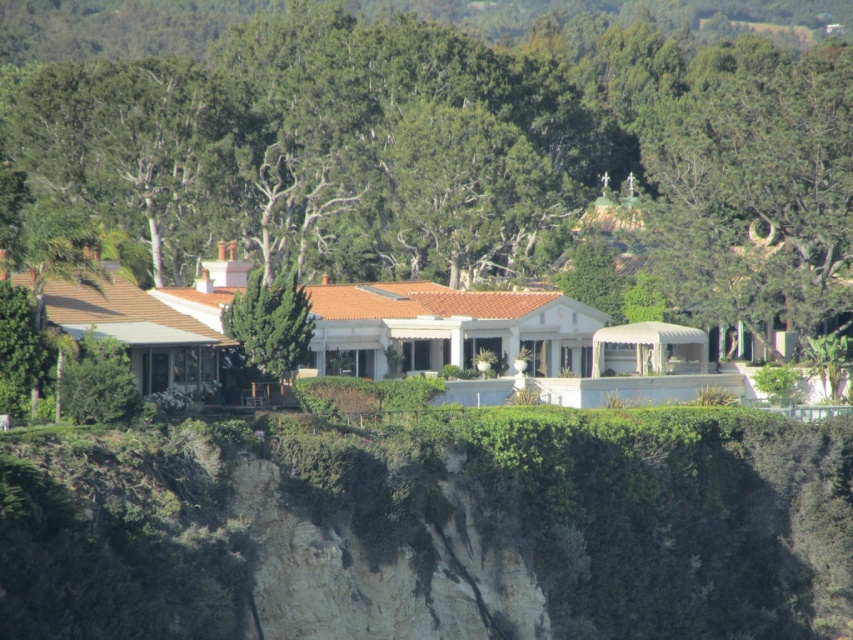
Question: Among these objects, which one is nearest to the camera?

Choices:
 (A) green leafy tree at center
 (B) green textured tree at center

Answer: (A)

Question: Does green mossy cliff at lower center appear on the right side of green textured tree at center?

Choices:
 (A) no
 (B) yes

Answer: (B)

Question: Which point is closer to the camera?

Choices:
 (A) green textured tree at center
 (B) green leafy tree at center

Answer: (B)

Question: Is the position of green leafy tree at center less distant than that of green textured tree at center?

Choices:
 (A) yes
 (B) no

Answer: (A)

Question: Considering the real-world distances, which object is closest to the green leafy tree at center?

Choices:
 (A) green mossy cliff at lower center
 (B) green textured tree at center

Answer: (B)

Question: Is green leafy tree at center closer to camera compared to green textured tree at center?

Choices:
 (A) no
 (B) yes

Answer: (B)